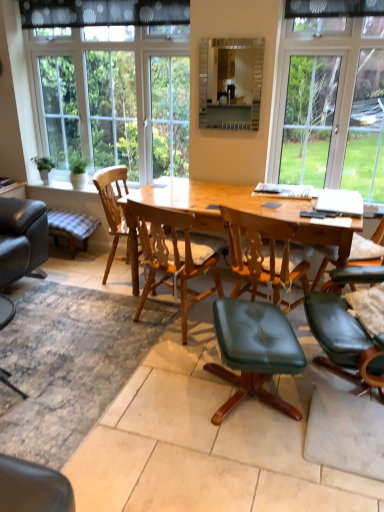
Question: Is point (218, 374) positioned closer to the camera than point (301, 117)?

Choices:
 (A) closer
 (B) farther

Answer: (A)

Question: In terms of width, does green leather stool at center, which is counted as the third chair, starting from the back, look wider or thinner when compared to clear glass window at upper right, which ranks as the first window in right-to-left order?

Choices:
 (A) wide
 (B) thin

Answer: (A)

Question: Estimate the real-world distances between objects in this image. Which object is farther from the wooden table at center?

Choices:
 (A) plaid fabric stool at lower left
 (B) clear glass window at upper right, which is the 2th window from left to right
 (C) wooden chair at center, which is the second chair in back-to-front order
 (D) clear glass window at upper left, the 1th window viewed from the left
 (E) wooden chair at center, acting as the third chair starting from the front

Answer: (A)

Question: Which object is the farthest from the plaid fabric stool at lower left?

Choices:
 (A) clear glass window at upper left, the 1th window viewed from the left
 (B) green leafy plant at left
 (C) black dotted fabric at upper center
 (D) black plastic remote control at center
 (E) clear glass window at upper right, which is the 2th window from left to right

Answer: (E)